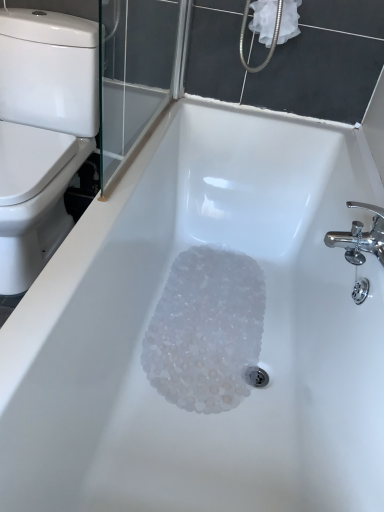
Find the location of a particular element. This screenshot has width=384, height=512. empty space that is ontop of translucent plastic crystals at bottom (from a real-world perspective) is located at coordinates (236, 320).